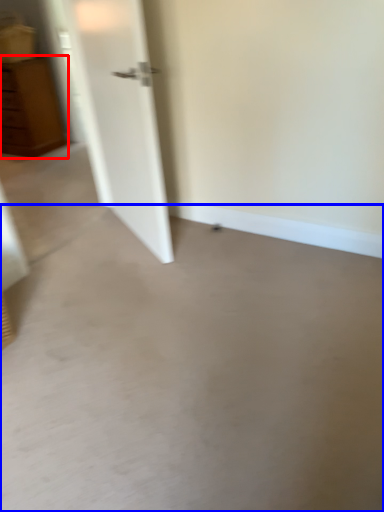
Question: Which point is further to the camera, chest of drawers (highlighted by a red box) or concrete (highlighted by a blue box)?

Choices:
 (A) chest of drawers
 (B) concrete

Answer: (A)